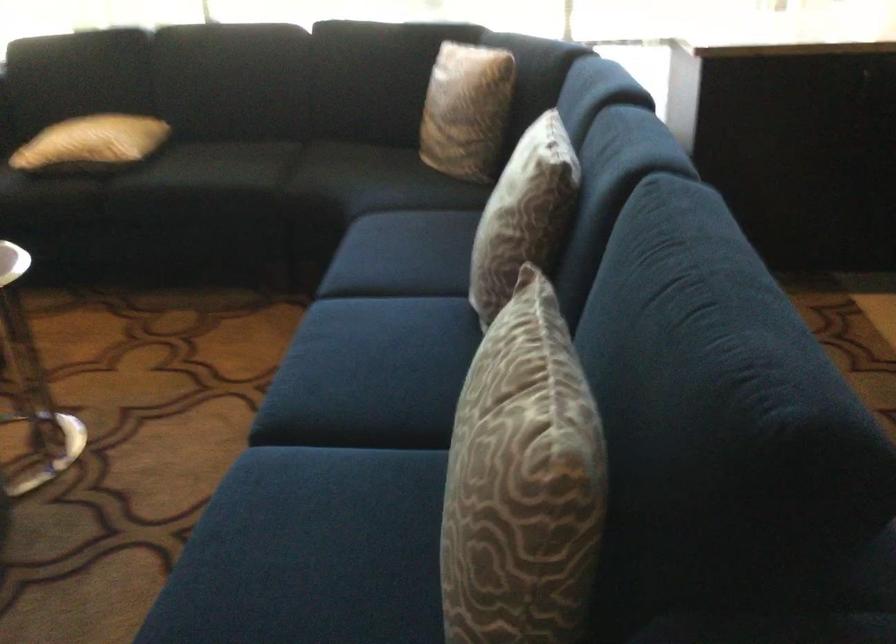
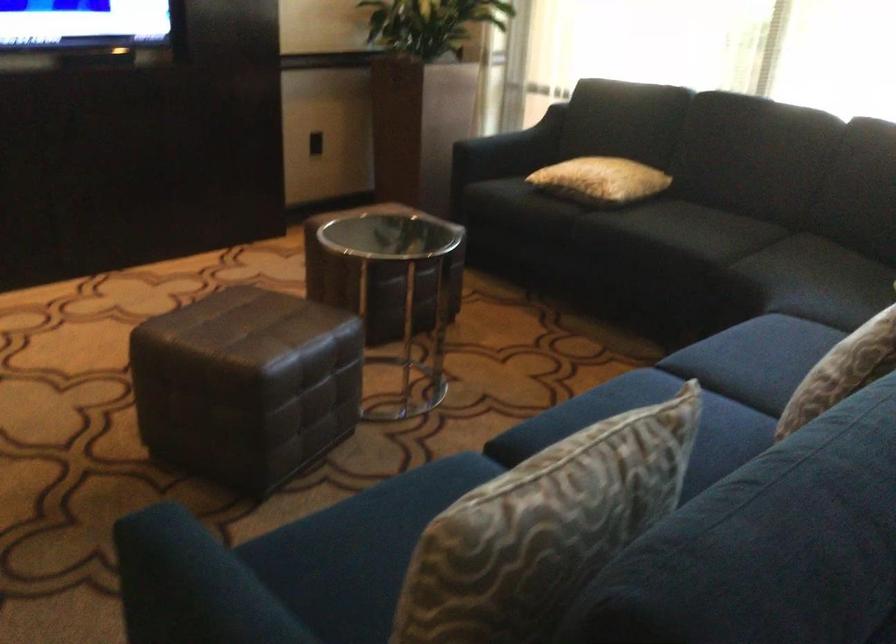
Question: The first image is from the beginning of the video and the second image is from the end. How did the camera likely rotate when shooting the video?

Choices:
 (A) Left
 (B) Right
 (C) Up
 (D) Down

Answer: (A)